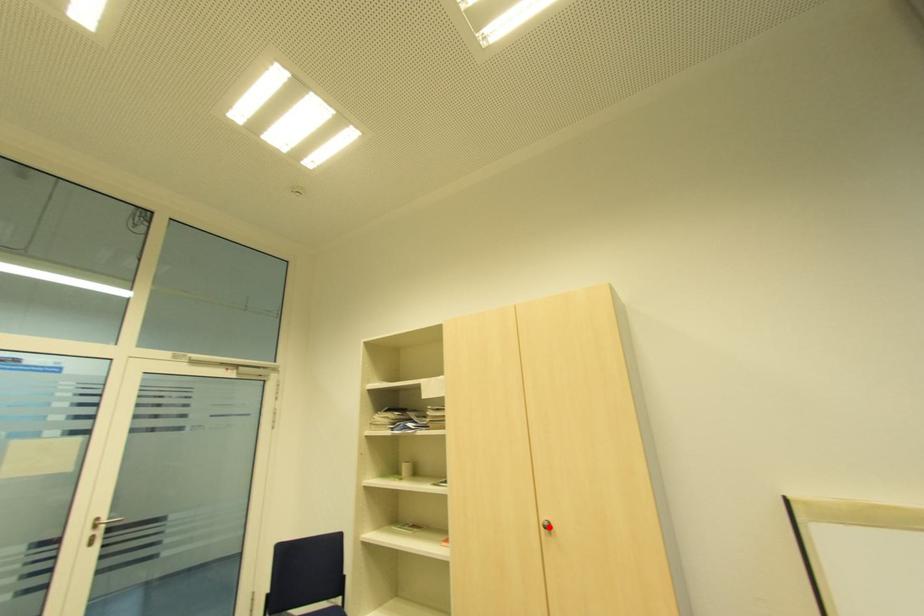
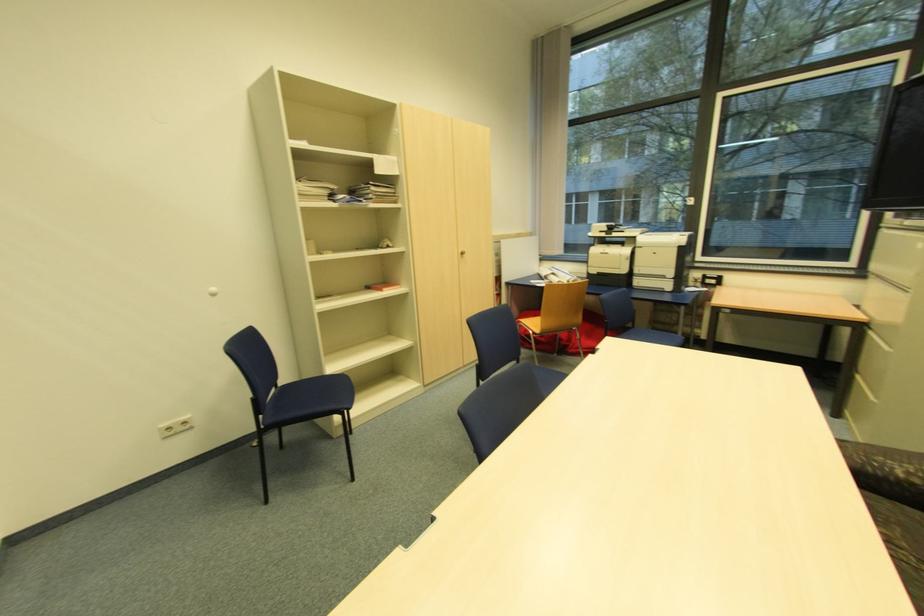
Question: I am providing you with two images of the same scene from different viewpoints. A red point is marked on the first image. Can you still see the location of the red point in image 2?

Choices:
 (A) Yes
 (B) No

Answer: (A)